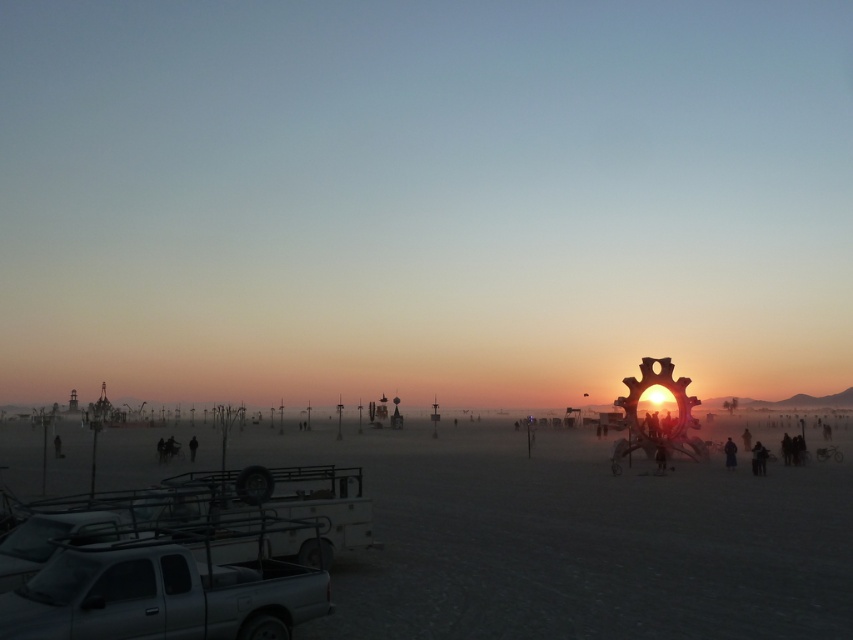
From the picture: You are standing in the desert scene and want to approach both the dark gray fabric jacket at lower right and the dark fabric figure at center. Which object should you reach first based on their positions?

You should reach the dark gray fabric jacket at lower right first because it is closer to you than the dark fabric figure at center.

You are a photographer setting up equipment in the desert. You have a tripod that requires a 2.0 meter space between two jackets to stabilize it. Are the dark gray fabric jacket at lower right and the dark brown leather jacket at lower right positioned far enough apart for this setup?

The distance between the dark gray fabric jacket at lower right and the dark brown leather jacket at lower right is 1.91 meters, which is less than the required 2.0 meters. Therefore, the jackets are not positioned far enough apart for the tripod setup.

You are a photographer planning to take a group photo of the dark fabric figure at center and the black fabric person at lower left. Which of the two should you place closer to the camera to ensure both appear the same size in the photo?

The dark fabric figure at center has a lesser width compared to the black fabric person at lower left. To make them appear the same size in the photo, place the dark fabric figure at center closer to the camera since it is smaller in width and needs to be magnified to match the size of the black fabric person at lower left.